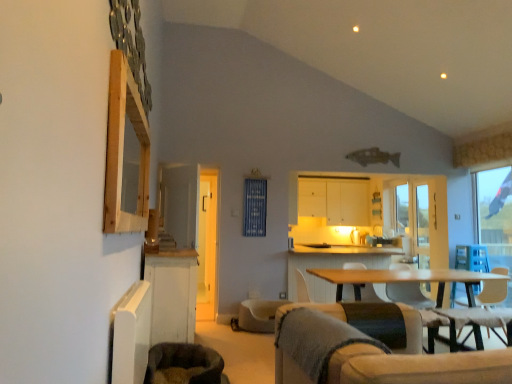
What is the approximate height of white fabric armchair at center?

The height of white fabric armchair at center is 16.75 inches.

What do you see at coordinates (422, 226) in the screenshot? I see `transparent glass screen door at right` at bounding box center [422, 226].

Identify the location of dark brown plush swivel chair at lower left, the 2th swivel chair when ordered from right to left. The image size is (512, 384). (184, 365).

Describe the element at coordinates (258, 315) in the screenshot. I see `beige fabric swivel chair at center, which is the 1th swivel chair in right-to-left order` at that location.

Image resolution: width=512 pixels, height=384 pixels. I want to click on light brown wooden table at center, so click(x=402, y=279).

What do you see at coordinates (255, 207) in the screenshot? I see `blue fabric curtain at center` at bounding box center [255, 207].

You are a GUI agent. You are given a task and a screenshot of the screen. Output one action in this format:
    pyautogui.click(x=<x>, y=<y>)
    Task: Click on the blue fabric curtain at center
    This screenshot has width=512, height=384.
    Given the screenshot: What is the action you would take?
    pyautogui.click(x=255, y=207)

You are a GUI agent. You are given a task and a screenshot of the screen. Output one action in this format:
    pyautogui.click(x=<x>, y=<y>)
    Task: Click on the white fabric armchair at center
    
    Given the screenshot: What is the action you would take?
    pyautogui.click(x=302, y=288)

Does dark brown plush swivel chair at lower left, the 2th swivel chair when ordered from right to left, touch white matte cabinet at upper center, which is the first cabinetry from back to front?

No.

Which of these two, dark brown plush swivel chair at lower left, the 2th swivel chair when ordered from right to left, or white matte cabinet at upper center, which is the 2th cabinetry from left to right, is thinner?

white matte cabinet at upper center, which is the 2th cabinetry from left to right, is thinner.

Is white matte cabinet at upper center, arranged as the second cabinetry when ordered from the bottom, inside dark brown plush swivel chair at lower left, the 2th swivel chair when ordered from right to left?

No, white matte cabinet at upper center, arranged as the second cabinetry when ordered from the bottom, is located outside of dark brown plush swivel chair at lower left, the 2th swivel chair when ordered from right to left.

Considering the sizes of objects dark brown plush swivel chair at lower left, the 2th swivel chair positioned from the back, and white matte cabinet at upper center, placed as the second cabinetry when sorted from front to back, in the image provided, who is bigger, dark brown plush swivel chair at lower left, the 2th swivel chair positioned from the back, or white matte cabinet at upper center, placed as the second cabinetry when sorted from front to back,?

With larger size is white matte cabinet at upper center, placed as the second cabinetry when sorted from front to back.

Is transparent glass screen door at right oriented away from white wood cabinet at lower left, which ranks as the 1th cabinetry in left-to-right order?

No, transparent glass screen door at right is not facing the opposite direction of white wood cabinet at lower left, which ranks as the 1th cabinetry in left-to-right order.

Who is shorter, transparent glass screen door at right or white wood cabinet at lower left, the 1th cabinetry positioned from the bottom?

Standing shorter between the two is white wood cabinet at lower left, the 1th cabinetry positioned from the bottom.

In the image, is transparent glass screen door at right positioned in front of or behind white wood cabinet at lower left, positioned as the second cabinetry in right-to-left order?

transparent glass screen door at right is positioned farther from the viewer than white wood cabinet at lower left, positioned as the second cabinetry in right-to-left order.

This screenshot has height=384, width=512. I want to click on table to the right of blue fabric curtain at center, so click(x=402, y=279).

How distant is light brown wooden table at center from blue fabric curtain at center?

5.69 feet.

How different are the orientations of light brown wooden table at center and blue fabric curtain at center in degrees?

They differ by 0.0506 degrees in their facing directions.

Is light brown wooden table at center to the left or to the right of blue fabric curtain at center in the image?

Based on their positions, light brown wooden table at center is located to the right of blue fabric curtain at center.

Consider the image. Is dark brown plush swivel chair at lower left, acting as the 1th swivel chair starting from the front, inside transparent glass screen door at right?

Actually, dark brown plush swivel chair at lower left, acting as the 1th swivel chair starting from the front, is outside transparent glass screen door at right.

From a real-world perspective, is transparent glass screen door at right below dark brown plush swivel chair at lower left, the 2th swivel chair positioned from the back?

No.

Considering the sizes of objects transparent glass screen door at right and dark brown plush swivel chair at lower left, acting as the 1th swivel chair starting from the front, in the image provided, who is thinner, transparent glass screen door at right or dark brown plush swivel chair at lower left, acting as the 1th swivel chair starting from the front,?

dark brown plush swivel chair at lower left, acting as the 1th swivel chair starting from the front, is thinner.

Is dark brown plush swivel chair at lower left, the 2th swivel chair positioned from the back, oriented away from beige fabric swivel chair at center, which appears as the 1th swivel chair when viewed from the back?

No.

From the image's perspective, is dark brown plush swivel chair at lower left, the 2th swivel chair positioned from the back, positioned above or below beige fabric swivel chair at center, which is the 1th swivel chair in right-to-left order?

Clearly, from the image's perspective, dark brown plush swivel chair at lower left, the 2th swivel chair positioned from the back, is above beige fabric swivel chair at center, which is the 1th swivel chair in right-to-left order.

From a real-world perspective, between dark brown plush swivel chair at lower left, the 2th swivel chair when ordered from right to left, and beige fabric swivel chair at center, which appears as the 1th swivel chair when viewed from the back, who is vertically lower?

From a 3D spatial view, beige fabric swivel chair at center, which appears as the 1th swivel chair when viewed from the back, is below.

From a real-world perspective, is white wood cabinet at lower left, the first cabinetry positioned from the front, under white fabric armchair at center?

Yes, from a real-world perspective, white wood cabinet at lower left, the first cabinetry positioned from the front, is below white fabric armchair at center.

Consider the image. Is there a large distance between white wood cabinet at lower left, the 1th cabinetry positioned from the bottom, and white fabric armchair at center?

Indeed, white wood cabinet at lower left, the 1th cabinetry positioned from the bottom, is not near white fabric armchair at center.

Is white fabric armchair at center surrounded by white wood cabinet at lower left, the first cabinetry positioned from the front?

No, white fabric armchair at center is not surrounded by white wood cabinet at lower left, the first cabinetry positioned from the front.

Consider the image. From the image's perspective, which one is positioned lower, white wood cabinet at lower left, the 1th cabinetry positioned from the bottom, or white fabric armchair at center?

white wood cabinet at lower left, the 1th cabinetry positioned from the bottom.

Is beige fabric armchair at lower right inside white matte cabinet at upper center, placed as the second cabinetry when sorted from front to back?

Actually, beige fabric armchair at lower right is outside white matte cabinet at upper center, placed as the second cabinetry when sorted from front to back.

Considering the relative sizes of white matte cabinet at upper center, which is the first cabinetry from back to front, and beige fabric armchair at lower right in the image provided, is white matte cabinet at upper center, which is the first cabinetry from back to front, bigger than beige fabric armchair at lower right?

No.

Is the depth of white matte cabinet at upper center, which appears as the first cabinetry when viewed from the top, greater than that of beige fabric armchair at lower right?

Yes, it is.

You are a GUI agent. You are given a task and a screenshot of the screen. Output one action in this format:
    pyautogui.click(x=<x>, y=<y>)
    Task: Click on the swivel chair that is the 1st one when counting downward from the white matte cabinet at upper center, arranged as the second cabinetry when ordered from the bottom (from the image's perspective)
    
    Given the screenshot: What is the action you would take?
    pyautogui.click(x=184, y=365)

Identify the location of screen door located above the white wood cabinet at lower left, positioned as the second cabinetry in right-to-left order (from a real-world perspective). The height and width of the screenshot is (384, 512). (422, 226).

In the scene shown: When comparing their distances from white fabric armchair at center, does light brown wooden table at center or transparent glass window at right seem further?

transparent glass window at right is further to white fabric armchair at center.

Looking at this image, when comparing their distances from beige fabric swivel chair at center, which appears as the 2th swivel chair when viewed from the front, does white matte cabinet at upper center, which is the first cabinetry from back to front, or dark brown plush swivel chair at lower left, the first swivel chair when ordered from left to right, seem closer?

dark brown plush swivel chair at lower left, the first swivel chair when ordered from left to right, lies closer to beige fabric swivel chair at center, which appears as the 2th swivel chair when viewed from the front, than the other object.

When comparing their distances from dark brown plush swivel chair at lower left, the 2th swivel chair positioned from the back, does blue fabric curtain at center or beige fabric swivel chair at center, arranged as the second swivel chair when viewed from the left, seem closer?

The object closer to dark brown plush swivel chair at lower left, the 2th swivel chair positioned from the back, is beige fabric swivel chair at center, arranged as the second swivel chair when viewed from the left.

Which object lies nearer to the anchor point dark brown plush swivel chair at lower left, acting as the 1th swivel chair starting from the front, white fabric armchair at center or beige fabric armchair at lower right?

Based on the image, beige fabric armchair at lower right appears to be nearer to dark brown plush swivel chair at lower left, acting as the 1th swivel chair starting from the front.

Estimate the real-world distances between objects in this image. Which object is closer to white matte cabinet at upper center, which is the first cabinetry from back to front, light brown wooden table at center or white fabric armchair at center?

Based on the image, light brown wooden table at center appears to be nearer to white matte cabinet at upper center, which is the first cabinetry from back to front.

Which object lies nearer to the anchor point white matte cabinet at upper center, which is the 2th cabinetry from left to right, dark brown plush swivel chair at lower left, the first swivel chair when ordered from left to right, or blue fabric curtain at center?

blue fabric curtain at center is closer to white matte cabinet at upper center, which is the 2th cabinetry from left to right.

Looking at the image, which one is located closer to beige fabric armchair at lower right, light brown wooden table at center or white wood cabinet at lower left, the 2th cabinetry viewed from the back?

The object closer to beige fabric armchair at lower right is white wood cabinet at lower left, the 2th cabinetry viewed from the back.

When comparing their distances from white matte cabinet at upper center, placed as the second cabinetry when sorted from front to back, does beige fabric swivel chair at center, arranged as the second swivel chair when viewed from the left, or white fabric armchair at center seem further?

The object further to white matte cabinet at upper center, placed as the second cabinetry when sorted from front to back, is beige fabric swivel chair at center, arranged as the second swivel chair when viewed from the left.

Where is `curtain between beige fabric armchair at lower right and white matte cabinet at upper center, which is the first cabinetry from back to front, from front to back`? curtain between beige fabric armchair at lower right and white matte cabinet at upper center, which is the first cabinetry from back to front, from front to back is located at coordinates (255, 207).

This screenshot has width=512, height=384. What are the coordinates of `cabinetry between dark brown plush swivel chair at lower left, acting as the 1th swivel chair starting from the front, and white matte cabinet at upper center, which appears as the first cabinetry when viewed from the top, along the z-axis` in the screenshot? It's located at (172, 295).

Image resolution: width=512 pixels, height=384 pixels. Find the location of `swivel chair between beige fabric armchair at lower right and white fabric armchair at center in the front-back direction`. swivel chair between beige fabric armchair at lower right and white fabric armchair at center in the front-back direction is located at coordinates (184, 365).

This screenshot has width=512, height=384. What are the coordinates of `table between beige fabric armchair at lower right and white fabric armchair at center from front to back` in the screenshot? It's located at (402, 279).